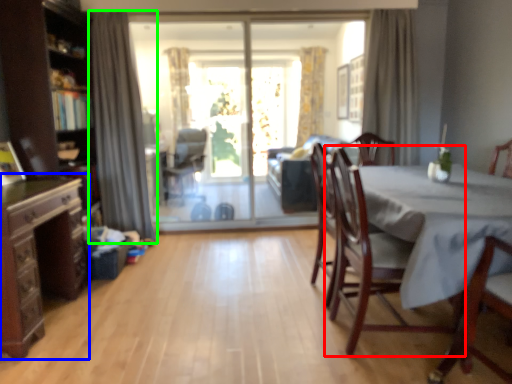
Question: Which is farther away from chair (highlighted by a red box)? dresser (highlighted by a blue box) or curtain (highlighted by a green box)?

Choices:
 (A) dresser
 (B) curtain

Answer: (B)